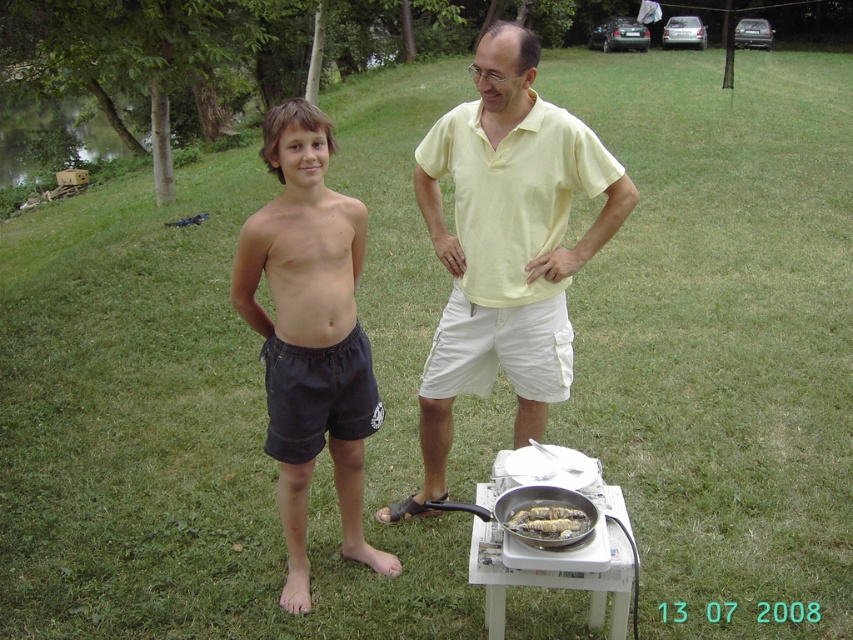
You are a photographer trying to capture both the dark cotton shorts at center and the brown crispy fish at lower center in a single frame. Which object should you focus on first if you want to ensure both are in focus, considering their sizes?

The dark cotton shorts at center is bigger than the brown crispy fish at lower center, so focusing on the larger object first would help ensure both are in focus.

You are standing at the edge of the water and want to grab the brown crispy fish at lower center without moving the silver metallic frying pan at lower center. Which direction should you move towards?

You should move towards the right because the silver metallic frying pan at lower center is to the left of the brown crispy fish at lower center, so moving right would allow you to reach the fish without disturbing the pan.